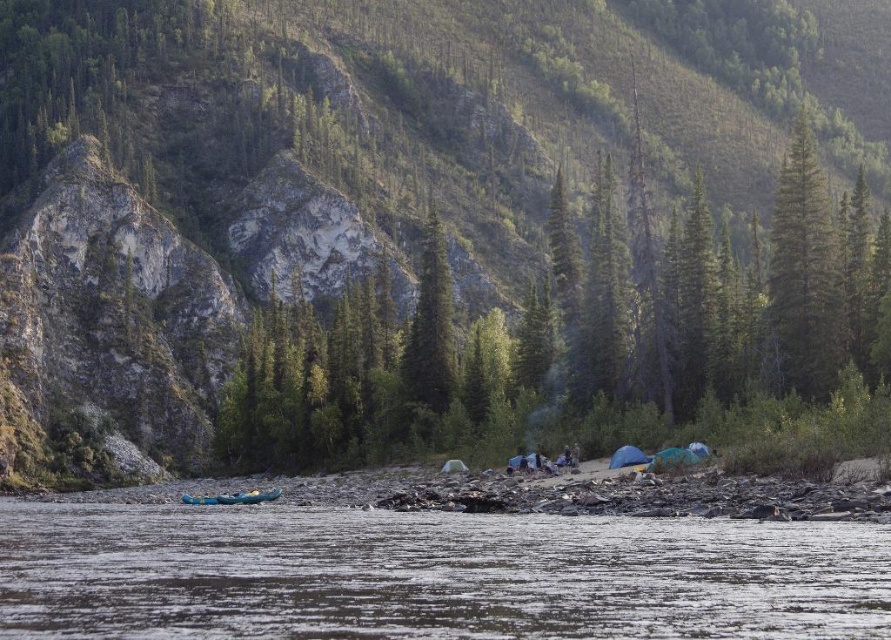
You are a hiker standing at the point with coordinates point (x=410, y=353) and want to reach the point with coordinates point (x=176, y=602). Which direction should you move to get closer to your destination?

You should move forward because point (x=176, y=602) is in front of point (x=410, y=353).

You are planning to set up a campsite near the clear water at lower center and the green textured tree at center. Based on their positions, which object should you place your tent closer to if you want it to be sheltered from the wind coming from the right side?

You should place your tent closer to the green textured tree at center because it is to the right of the clear water at lower center, so the tree will block the wind coming from the right side.

You are a hiker who wants to take a photo of the green matte tree at upper right while standing near the clear water at lower center. Is the tree visible from your current position?

The clear water at lower center is located below the green matte tree at upper right, so yes, the tree is visible from the clear water at lower center.